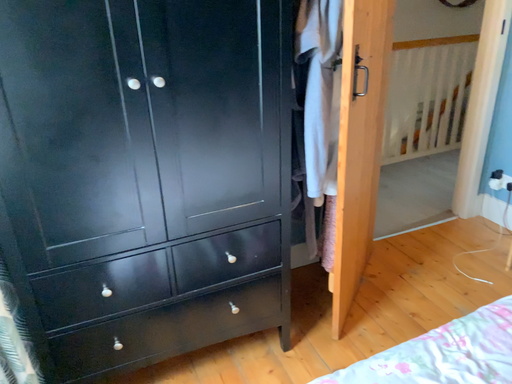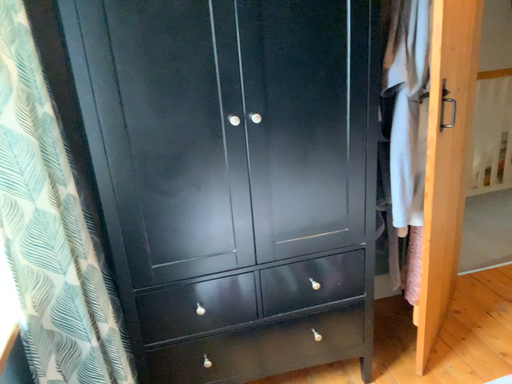
Question: How did the camera likely rotate when shooting the video?

Choices:
 (A) rotated right
 (B) rotated left

Answer: (B)